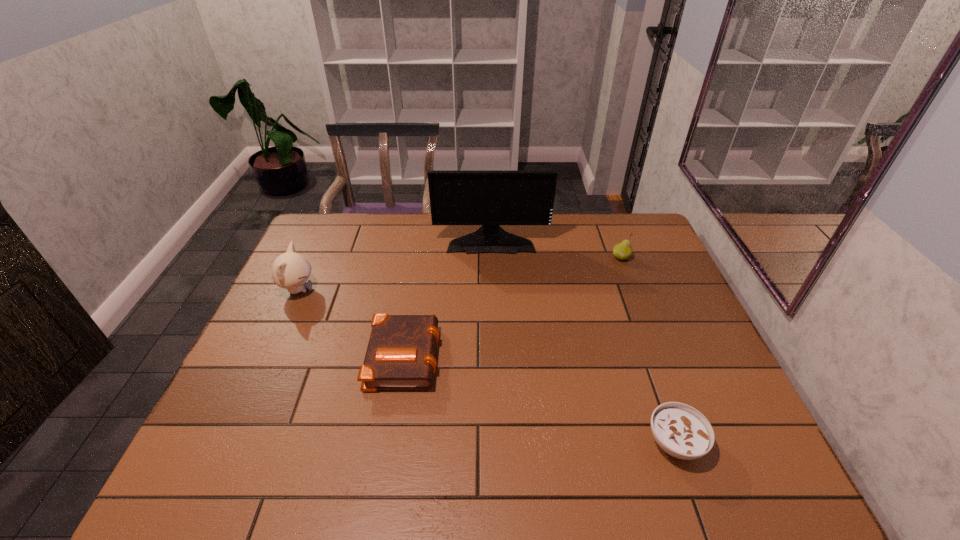
Identify the location of the tallest object. point(489,198).

This screenshot has width=960, height=540. Identify the location of the third nearest object. (290, 270).

Image resolution: width=960 pixels, height=540 pixels. I want to click on the leftmost object, so click(x=290, y=270).

Locate an element on the screen. Image resolution: width=960 pixels, height=540 pixels. the third tallest object is located at coordinates (623, 250).

I want to click on the fourth farthest object, so click(400, 355).

Locate an element on the screen. This screenshot has width=960, height=540. the nearest object is located at coordinates (680, 430).

Identify the location of free space located 0.270m on the screen side of the monitor. This screenshot has height=540, width=960. (493, 311).

Where is `blank space located on the face of the fourth shortest object`? blank space located on the face of the fourth shortest object is located at coordinates (410, 290).

In order to click on free space located on the back of the third tallest object in this screenshot , I will do `click(609, 225)`.

This screenshot has width=960, height=540. In order to click on vacant position located on the spine side of the second nearest object in this screenshot , I will do `click(552, 355)`.